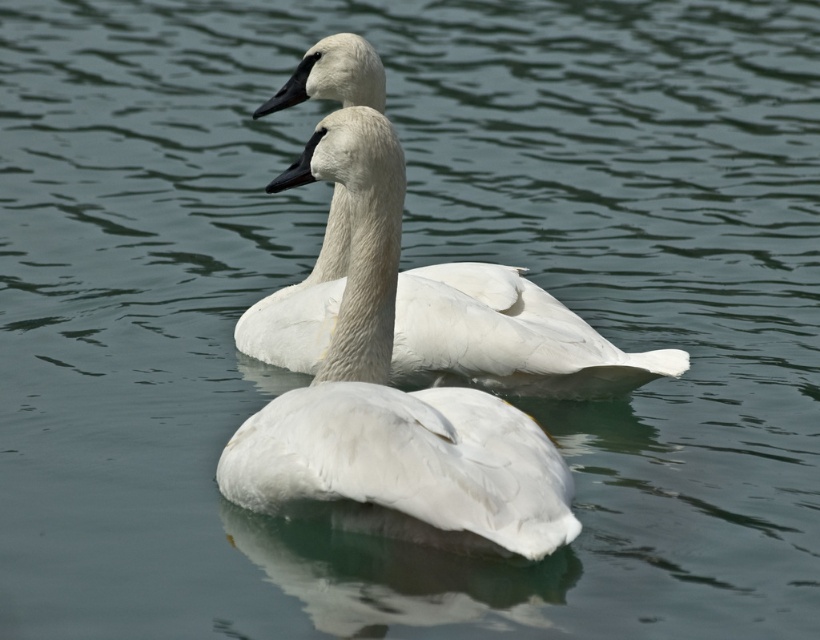
Is white feathered swan at center below white matte swan at center?

Indeed, white feathered swan at center is positioned under white matte swan at center.

Can you confirm if white feathered swan at center is positioned to the right of white matte swan at center?

In fact, white feathered swan at center is to the left of white matte swan at center.

The height and width of the screenshot is (640, 820). In order to click on white feathered swan at center in this screenshot , I will do `click(392, 401)`.